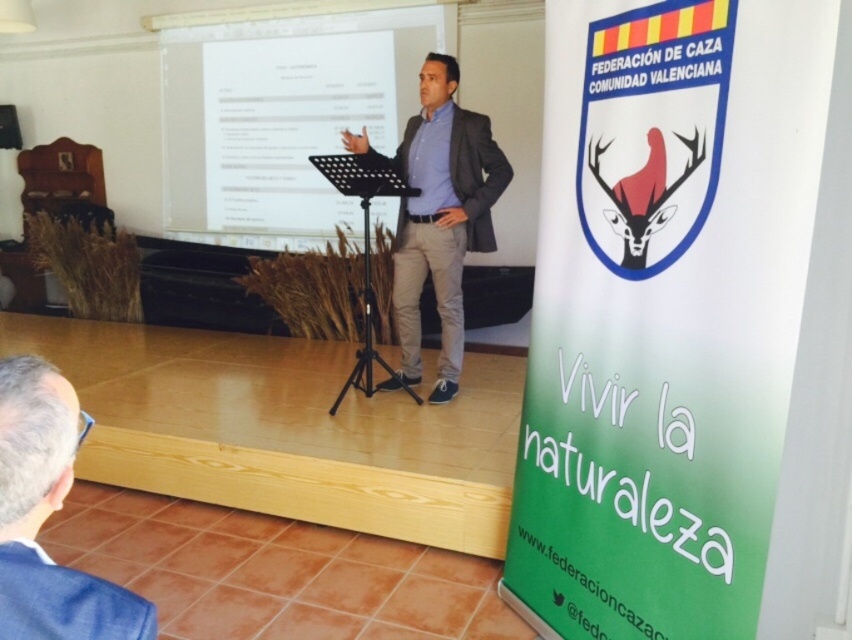
Question: Does white glossy projector screen at upper center have a smaller size compared to gray fabric suit at lower left?

Choices:
 (A) yes
 (B) no

Answer: (B)

Question: Observing the image, what is the correct spatial positioning of white glossy projector screen at upper center in reference to dark gray suit at center?

Choices:
 (A) right
 (B) left

Answer: (B)

Question: Is the position of white glossy projector screen at upper center more distant than that of dark gray suit at center?

Choices:
 (A) yes
 (B) no

Answer: (A)

Question: Which point is farther to the camera?

Choices:
 (A) white glossy projector screen at upper center
 (B) gray fabric suit at lower left

Answer: (A)

Question: Which object is closer to the camera taking this photo?

Choices:
 (A) dark gray suit at center
 (B) gray fabric suit at lower left
 (C) white glossy projector screen at upper center

Answer: (B)

Question: Which is farther from the dark gray suit at center?

Choices:
 (A) gray fabric suit at lower left
 (B) white glossy projector screen at upper center

Answer: (A)